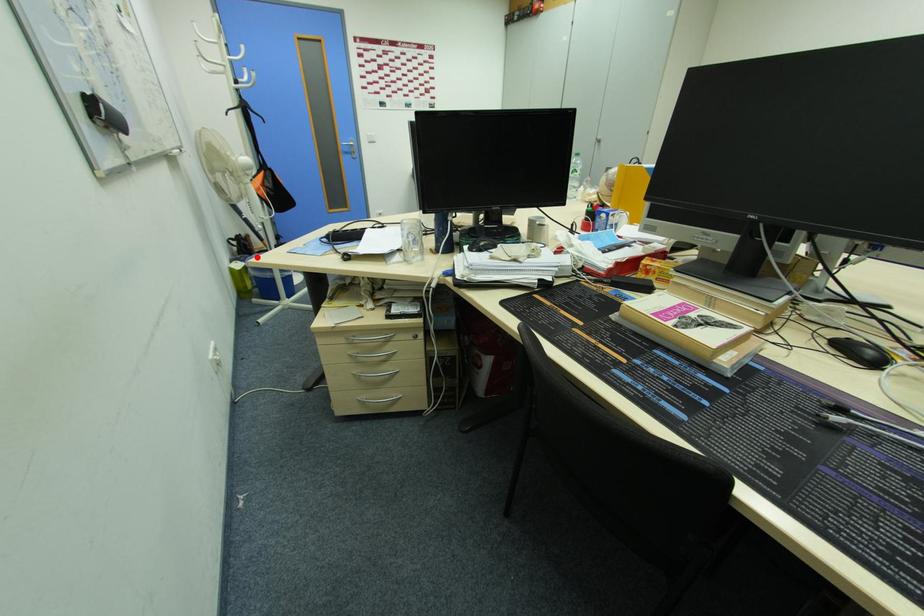
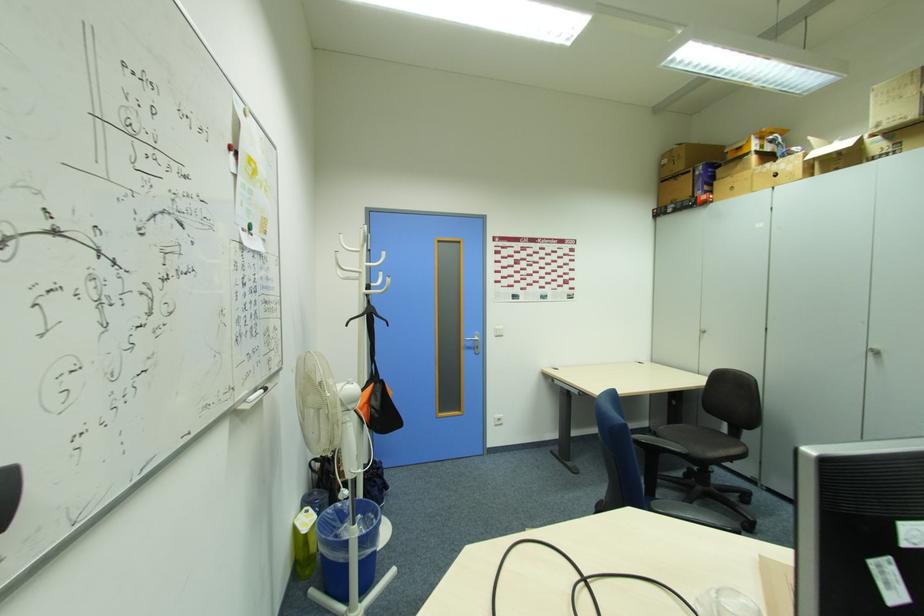
Question: I am providing you with two images of the same scene from different viewpoints. Image1 has a red point marked. In image2, the corresponding 3D location appears at what relative position? Reply with the corresponding letter.

Choices:
 (A) Closer
 (B) Farther

Answer: (A)